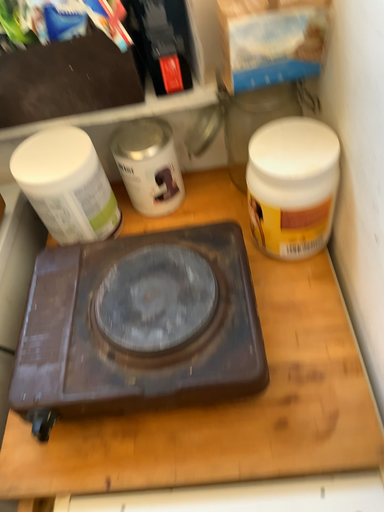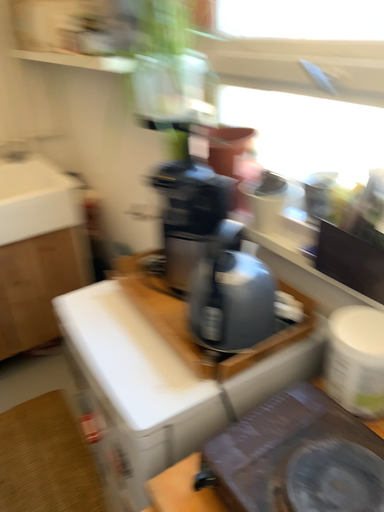
Question: How did the camera likely rotate when shooting the video?

Choices:
 (A) rotated left
 (B) rotated right

Answer: (A)